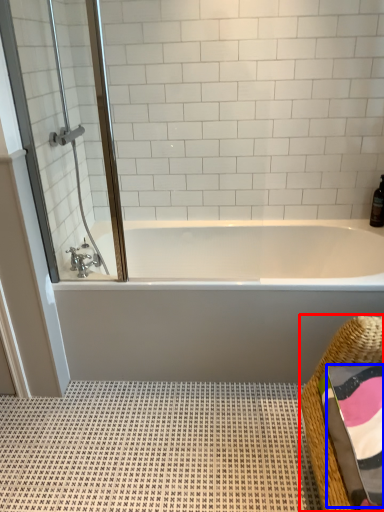
Question: Which of the following is the farthest to the observer, basket (highlighted by a red box) or bath towel (highlighted by a blue box)?

Choices:
 (A) basket
 (B) bath towel

Answer: (B)